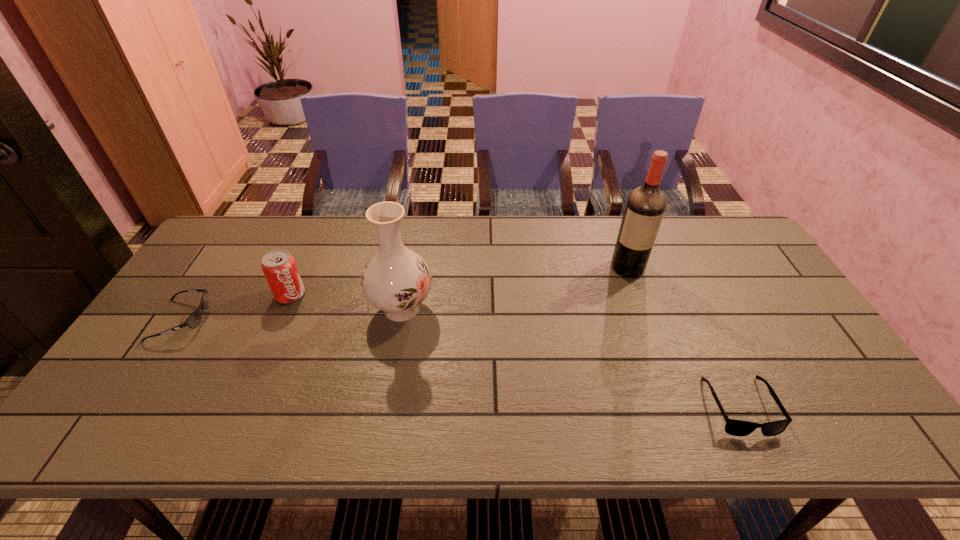
Identify the location of vacant region located on the front-facing side of the fourth object from left to right. (652, 333).

Find the location of a particular element. This screenshot has height=540, width=960. vacant area located 0.100m on the front of the third object from right to left is located at coordinates click(x=392, y=364).

Locate an element on the screen. The width and height of the screenshot is (960, 540). vacant space positioned on the right of the third tallest object is located at coordinates (381, 294).

At what (x,y) coordinates should I click in order to perform the action: click on free region located on the front-facing side of the farther sunglasses. Please return your answer as a coordinate pair (x, y). This screenshot has width=960, height=540. Looking at the image, I should click on (252, 320).

The height and width of the screenshot is (540, 960). Find the location of `object present at the far edge`. object present at the far edge is located at coordinates (645, 206).

At what (x,y) coordinates should I click in order to perform the action: click on object at the near edge. Please return your answer as a coordinate pair (x, y). Looking at the image, I should click on (733, 427).

I want to click on object at the left edge, so click(x=193, y=321).

Identify the location of free location at the far edge. Image resolution: width=960 pixels, height=540 pixels. (284, 227).

Find the location of a particular element. free spot at the near edge of the desktop is located at coordinates (305, 411).

The width and height of the screenshot is (960, 540). I want to click on vacant space at the left edge of the desktop, so click(x=202, y=263).